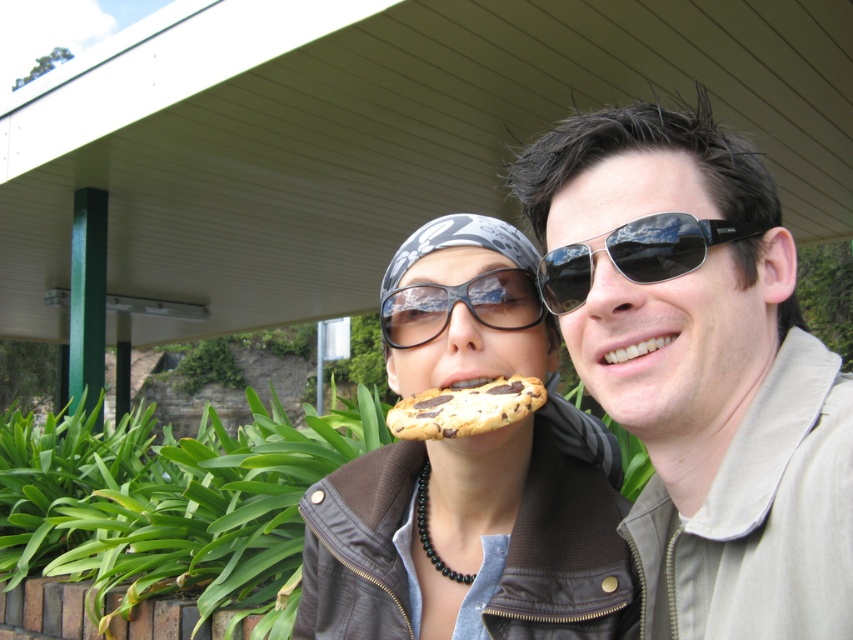
You are a photographer trying to capture a closeup of the sunglasses at center without including the brown leather jacket at center in the frame. Given their relative sizes, is this possible?

The brown leather jacket at center is wider than the sunglasses at center, so it might be challenging to frame the sunglasses at center without including the jacket if they are positioned closely together. Adjust your angle or zoom in to isolate the sunglasses at center.

You are a photographer holding a camera. You want to take a photo of the brown leather jacket at center without moving the camera. Is the jacket within the camera lens range of 3 feet?

The brown leather jacket at center and camera are 3.68 feet apart from each other, so the jacket is slightly out of the camera lens range of 3 feet.